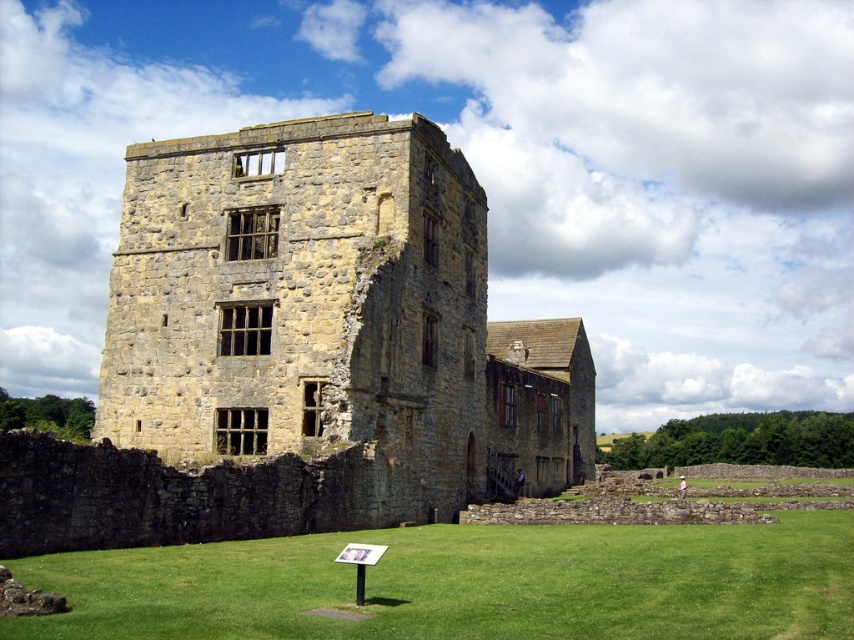
Question: Does yellow stone tower at center come behind green grass at lower center?

Choices:
 (A) yes
 (B) no

Answer: (A)

Question: Is yellow stone tower at center bigger than green grass at lower center?

Choices:
 (A) yes
 (B) no

Answer: (A)

Question: Can you confirm if yellow stone tower at center is bigger than green grass at lower center?

Choices:
 (A) no
 (B) yes

Answer: (B)